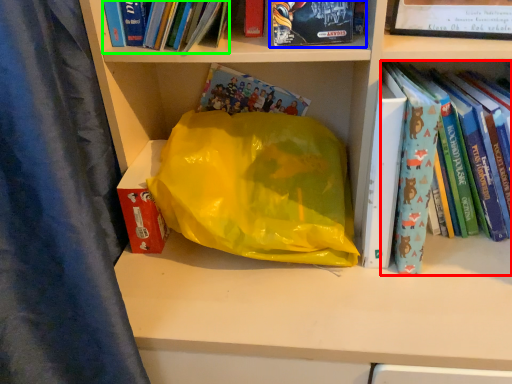
Question: Which object is positioned farthest from book (highlighted by a red box)? Select from book (highlighted by a blue box) and book (highlighted by a green box).

Choices:
 (A) book
 (B) book

Answer: (B)